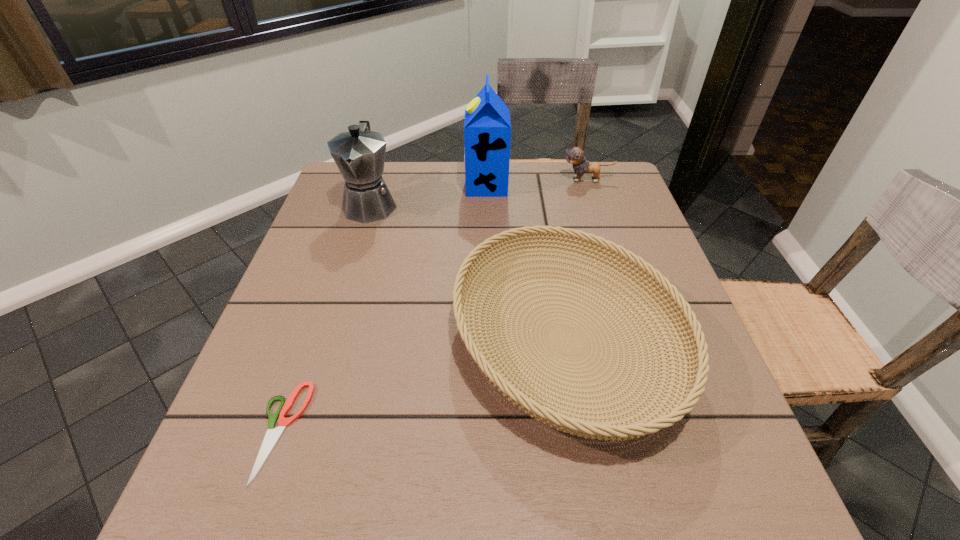
Where is `carton`? carton is located at coordinates (487, 128).

I want to click on coffeepot, so click(x=359, y=154).

In order to click on kitten in this screenshot , I will do `click(575, 156)`.

You are a GUI agent. You are given a task and a screenshot of the screen. Output one action in this format:
    pyautogui.click(x=<x>, y=<y>)
    Task: Click on the basket
    This screenshot has width=960, height=540.
    Given the screenshot: What is the action you would take?
    pyautogui.click(x=695, y=371)

Locate an element on the screen. Image resolution: width=960 pixels, height=540 pixels. scissors is located at coordinates (272, 435).

The width and height of the screenshot is (960, 540). I want to click on free space located 0.190m with the cap open on the tallest object, so tap(397, 185).

Identify the location of free region located with the cap open on the tallest object. The image size is (960, 540). (387, 185).

At what (x,y) coordinates should I click in order to perform the action: click on vacant area located 0.060m with the cap open on the tallest object. Please return your answer as a coordinate pair (x, y). Image resolution: width=960 pixels, height=540 pixels. Looking at the image, I should click on (444, 185).

The height and width of the screenshot is (540, 960). I want to click on vacant position located at the spout of the second tallest object, so click(358, 244).

This screenshot has width=960, height=540. Identify the location of vacant area located 0.400m on the front-facing side of the kitten. (420, 180).